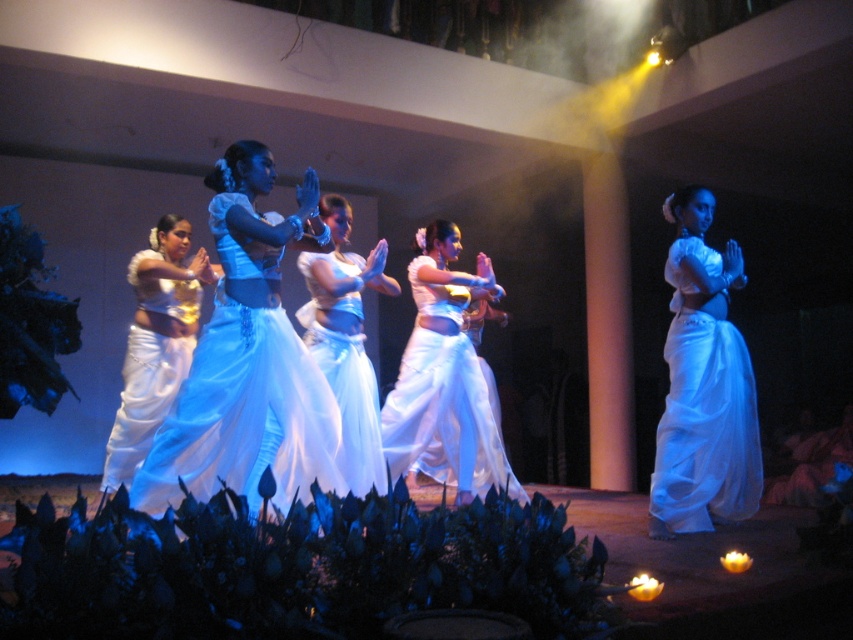
Question: Is white satin sari at center to the left of white silk sari at center from the viewer's perspective?

Choices:
 (A) no
 (B) yes

Answer: (A)

Question: Which of the following is the farthest from the observer?

Choices:
 (A) pos(714,513)
 (B) pos(376,486)

Answer: (A)

Question: Is matte white skirt at center above white silk sari at center?

Choices:
 (A) no
 (B) yes

Answer: (B)

Question: Observing the image, what is the correct spatial positioning of matte white skirt at center in reference to white satin skirt at center?

Choices:
 (A) left
 (B) right

Answer: (A)

Question: Which object is the closest to the matte white skirt at center?

Choices:
 (A) white satin skirt at center
 (B) white silk sari at center
 (C) white satin sari at center
 (D) white silk skirt at center

Answer: (A)

Question: Estimate the real-world distances between objects in this image. Which object is farther from the white satin skirt at center?

Choices:
 (A) white silk sari at center
 (B) white silk skirt at center
 (C) white satin sari at center
 (D) matte white skirt at center

Answer: (C)